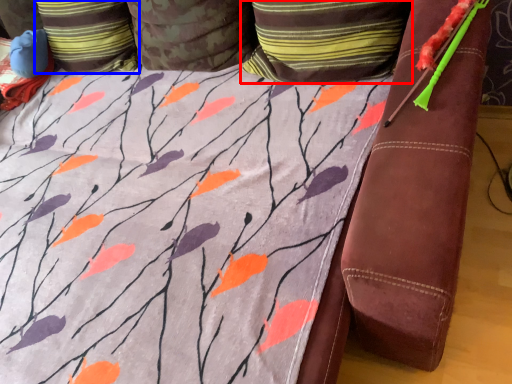
Question: Which point is further to the camera, pillow (highlighted by a red box) or pillow (highlighted by a blue box)?

Choices:
 (A) pillow
 (B) pillow

Answer: (B)